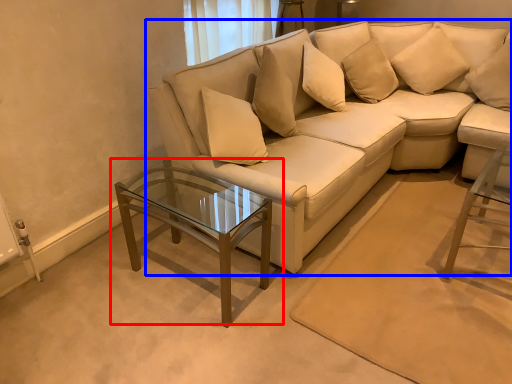
Question: Among these objects, which one is nearest to the camera, coffee table (highlighted by a red box) or studio couch (highlighted by a blue box)?

Choices:
 (A) coffee table
 (B) studio couch

Answer: (A)